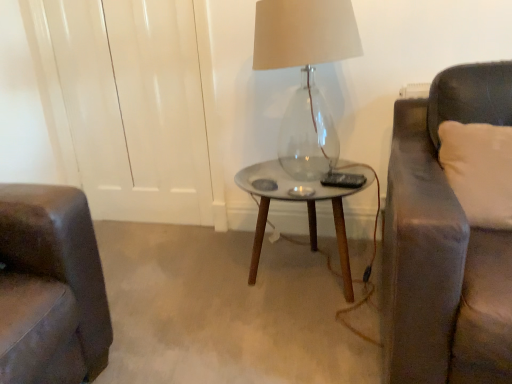
Question: Is translucent glass lamp at center in front of or behind white soft cushion at right in the image?

Choices:
 (A) behind
 (B) front

Answer: (A)

Question: Visually, is translucent glass lamp at center positioned to the left or to the right of white soft cushion at right?

Choices:
 (A) right
 (B) left

Answer: (B)

Question: Which is nearer to the metallic silver table at center?

Choices:
 (A) translucent glass lamp at center
 (B) white soft cushion at right

Answer: (A)

Question: Which is nearer to the white soft cushion at right?

Choices:
 (A) translucent glass lamp at center
 (B) metallic silver table at center

Answer: (B)